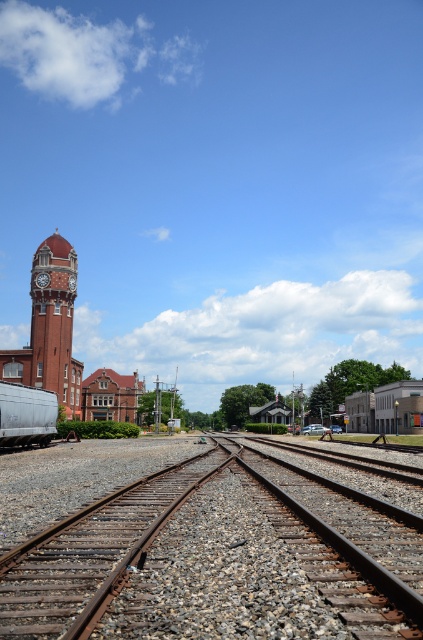
Question: Is matte brick clock tower at left further to the viewer compared to silver metallic train car at lower left?

Choices:
 (A) no
 (B) yes

Answer: (B)

Question: Is the position of matte brick clock tower at left more distant than that of silver metallic train car at lower left?

Choices:
 (A) yes
 (B) no

Answer: (A)

Question: Among these points, which one is farthest from the camera?

Choices:
 (A) (55, 400)
 (B) (302, 515)
 (C) (54, 376)

Answer: (C)

Question: Which object is positioned farthest from the rusty metal train tracks at center?

Choices:
 (A) silver metallic train car at lower left
 (B) matte brick clock tower at left

Answer: (B)

Question: Which of the following is the closest to the observer?

Choices:
 (A) rusty metal train tracks at center
 (B) matte brick clock tower at left
 (C) silver metallic train car at lower left

Answer: (A)

Question: Considering the relative positions of rusty metal train tracks at center and matte brick clock tower at left in the image provided, where is rusty metal train tracks at center located with respect to matte brick clock tower at left?

Choices:
 (A) right
 (B) left

Answer: (A)